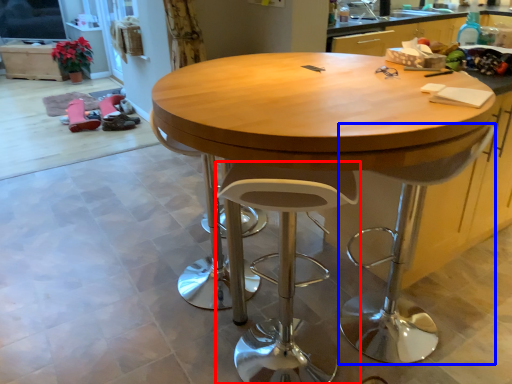
Question: Which point is closer to the camera, stool (highlighted by a red box) or swivel chair (highlighted by a blue box)?

Choices:
 (A) stool
 (B) swivel chair

Answer: (A)